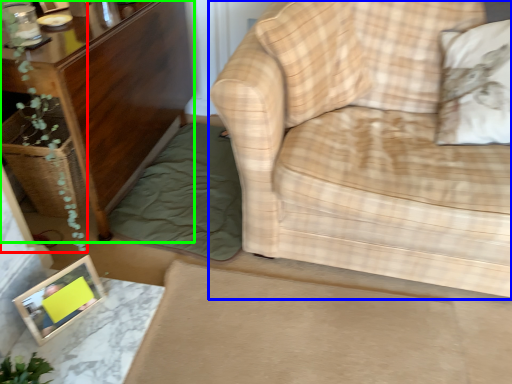
Question: Based on their relative distances, which object is nearer to plant (highlighted by a red box)? Choose from studio couch (highlighted by a blue box) and furniture (highlighted by a green box).

Choices:
 (A) studio couch
 (B) furniture

Answer: (B)